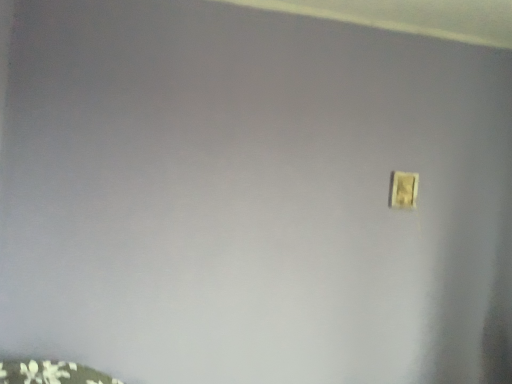
Image resolution: width=512 pixels, height=384 pixels. In order to click on yellow matte light switch at upper right in this screenshot , I will do `click(404, 190)`.

This screenshot has height=384, width=512. What do you see at coordinates (404, 190) in the screenshot?
I see `yellow matte light switch at upper right` at bounding box center [404, 190].

You are a GUI agent. You are given a task and a screenshot of the screen. Output one action in this format:
    pyautogui.click(x=<x>, y=<y>)
    Task: Click on the yellow matte light switch at upper right
    This screenshot has height=384, width=512.
    Given the screenshot: What is the action you would take?
    pyautogui.click(x=404, y=190)